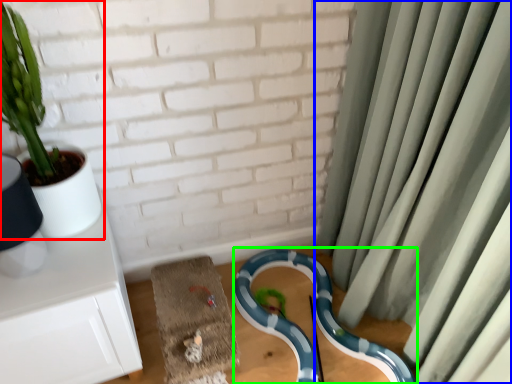
Question: Based on their relative distances, which object is farther from houseplant (highlighted by a red box)? Choose from curtain (highlighted by a blue box) and snake (highlighted by a green box).

Choices:
 (A) curtain
 (B) snake

Answer: (A)